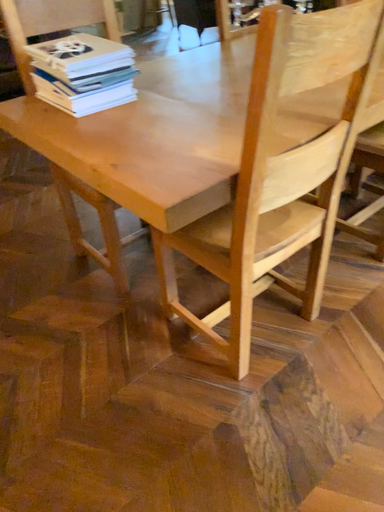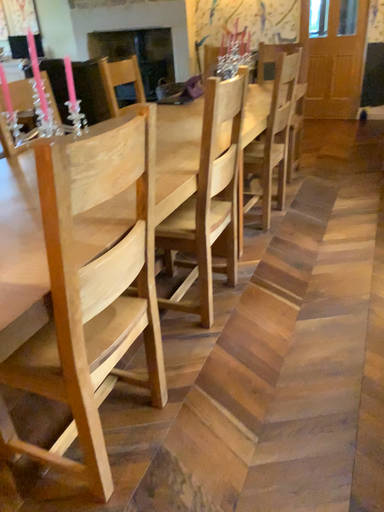
Question: Which way did the camera rotate in the video?

Choices:
 (A) rotated downward
 (B) rotated upward

Answer: (B)